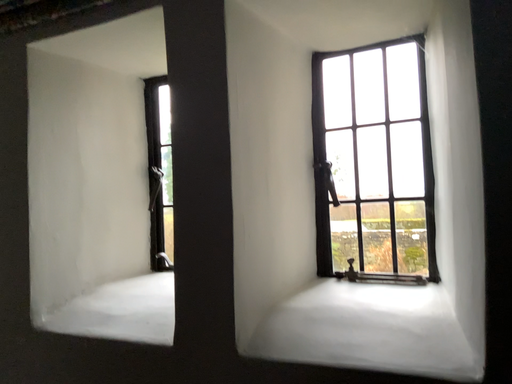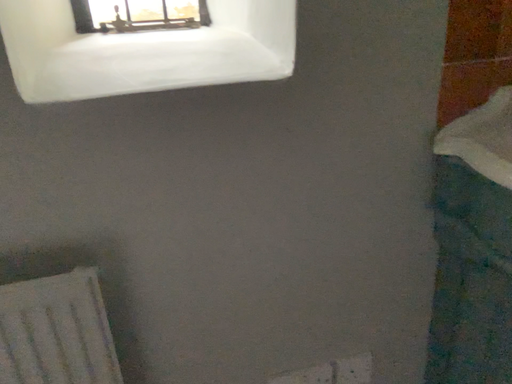
Question: How did the camera likely rotate when shooting the video?

Choices:
 (A) rotated left
 (B) rotated right

Answer: (B)